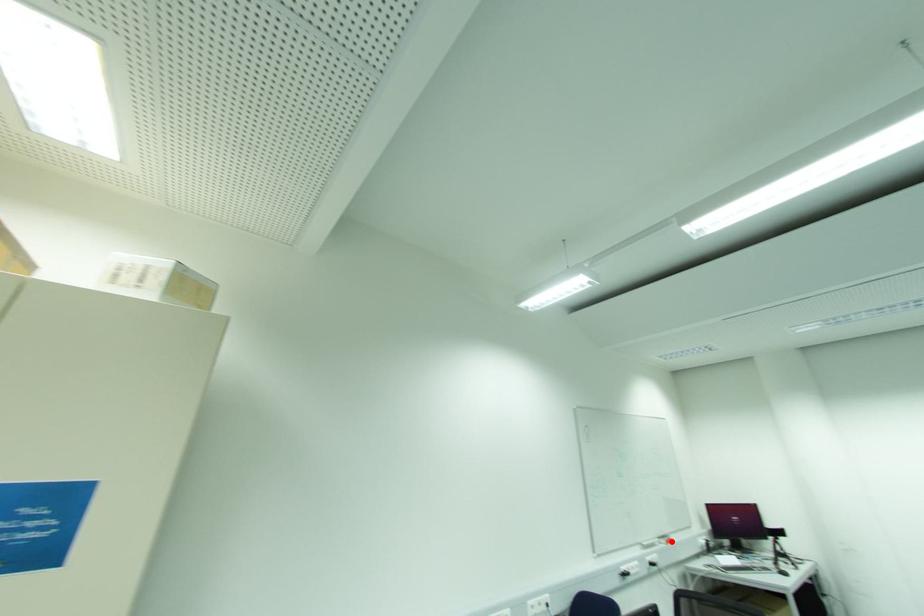
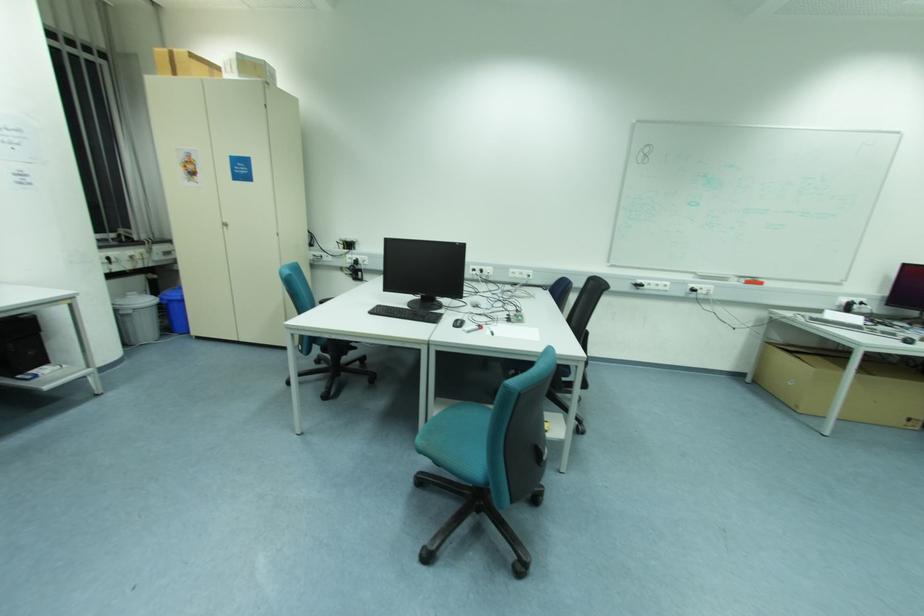
Where in the second image is the point corresponding to the highlighted location from the first image?

(761, 284)